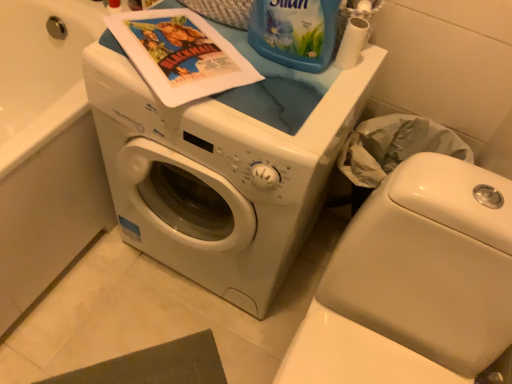
Where is `free space in front of white matte toilet paper at upper right`? The image size is (512, 384). free space in front of white matte toilet paper at upper right is located at coordinates (318, 101).